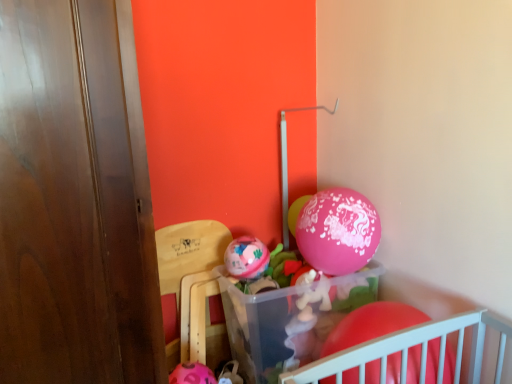
Where is `wooden chair at lower left`? wooden chair at lower left is located at coordinates (185, 274).

This screenshot has width=512, height=384. Identify the location of matte pink balloon at center, the 2th balloon when ordered from bottom to top. (246, 258).

Image resolution: width=512 pixels, height=384 pixels. In order to click on wooden chair at lower left in this screenshot , I will do `click(185, 274)`.

Measure the distance from pink glossy balloon at center, which ranks as the second balloon in left-to-right order, to matte pink balloon at center, placed as the first balloon when sorted from left to right.

pink glossy balloon at center, which ranks as the second balloon in left-to-right order, and matte pink balloon at center, placed as the first balloon when sorted from left to right, are 9.30 inches apart.

Starting from the matte pink balloon at center, which is the 2th balloon in top-to-bottom order, which balloon is the 1st one to the right? Please provide its 2D coordinates.

[(296, 212)]

Can you confirm if pink glossy balloon at center, the 2th balloon viewed from the right, is taller than matte pink balloon at center, the second balloon when ordered from back to front?

Indeed, pink glossy balloon at center, the 2th balloon viewed from the right, has a greater height compared to matte pink balloon at center, the second balloon when ordered from back to front.

From a real-world perspective, is pink glossy balloon at center, the 2th balloon viewed from the right, physically below matte pink balloon at center, placed as the first balloon when sorted from left to right?

No.

Is wooden chair at lower left wider or thinner than rubber matte balloon at lower right, the 3th balloon when ordered from back to front?

wooden chair at lower left is thinner than rubber matte balloon at lower right, the 3th balloon when ordered from back to front.

From a real-world perspective, is wooden chair at lower left positioned under rubber matte balloon at lower right, the third balloon when ordered from left to right, based on gravity?

Yes.

Does wooden chair at lower left turn towards rubber matte balloon at lower right, the third balloon viewed from the top?

No, wooden chair at lower left is not facing towards rubber matte balloon at lower right, the third balloon viewed from the top.

The width and height of the screenshot is (512, 384). I want to click on armchair behind the rubber matte balloon at lower right, which is the first balloon from front to back, so click(x=185, y=274).

Considering the relative sizes of matte pink balloon at center, which is the 2th balloon in top-to-bottom order, and wooden chair at lower left in the image provided, is matte pink balloon at center, which is the 2th balloon in top-to-bottom order, smaller than wooden chair at lower left?

Yes, matte pink balloon at center, which is the 2th balloon in top-to-bottom order, is smaller than wooden chair at lower left.

Is matte pink balloon at center, the 2th balloon when ordered from bottom to top, aimed at wooden chair at lower left?

No, matte pink balloon at center, the 2th balloon when ordered from bottom to top, is not oriented towards wooden chair at lower left.

Considering the sizes of objects matte pink balloon at center, the 3th balloon viewed from the right, and wooden chair at lower left in the image provided, who is shorter, matte pink balloon at center, the 3th balloon viewed from the right, or wooden chair at lower left?

matte pink balloon at center, the 3th balloon viewed from the right, is shorter.

Is matte pink balloon at center, the 2th balloon when ordered from bottom to top, further to camera compared to wooden chair at lower left?

That is True.

Is wooden chair at lower left oriented away from matte pink balloon at center, the 3th balloon viewed from the right?

wooden chair at lower left does not have its back to matte pink balloon at center, the 3th balloon viewed from the right.

From the image's perspective, is wooden chair at lower left over matte pink balloon at center, the 3th balloon viewed from the right?

No, from the image's perspective, wooden chair at lower left is not above matte pink balloon at center, the 3th balloon viewed from the right.

Considering the sizes of objects wooden chair at lower left and matte pink balloon at center, the second balloon when ordered from back to front, in the image provided, who is taller, wooden chair at lower left or matte pink balloon at center, the second balloon when ordered from back to front,?

wooden chair at lower left.

Between pink glossy balloon at center, which is the third balloon from front to back, and wooden chair at lower left, which one has smaller width?

pink glossy balloon at center, which is the third balloon from front to back, is thinner.

Between pink glossy balloon at center, acting as the 3th balloon starting from the bottom, and wooden chair at lower left, which one appears on the right side from the viewer's perspective?

Positioned to the right is pink glossy balloon at center, acting as the 3th balloon starting from the bottom.

Locate an element on the screen. Image resolution: width=512 pixels, height=384 pixels. armchair in front of the pink glossy balloon at center, the 1th balloon positioned from the top is located at coordinates (185, 274).

Considering the sizes of pink glossy balloon at center, acting as the 3th balloon starting from the bottom, and wooden chair at lower left in the image, is pink glossy balloon at center, acting as the 3th balloon starting from the bottom, bigger or smaller than wooden chair at lower left?

pink glossy balloon at center, acting as the 3th balloon starting from the bottom, is smaller than wooden chair at lower left.

Considering the sizes of pink glossy balloon at center, the 1th balloon positioned from the back, and rubber matte balloon at lower right, the third balloon when ordered from left to right, in the image, is pink glossy balloon at center, the 1th balloon positioned from the back, wider or thinner than rubber matte balloon at lower right, the third balloon when ordered from left to right,?

Considering their sizes, pink glossy balloon at center, the 1th balloon positioned from the back, looks slimmer than rubber matte balloon at lower right, the third balloon when ordered from left to right.

From the image's perspective, who appears lower, pink glossy balloon at center, the 1th balloon positioned from the back, or rubber matte balloon at lower right, the third balloon viewed from the top?

rubber matte balloon at lower right, the third balloon viewed from the top.

Which is less distant, (x=298, y=202) or (x=371, y=325)?

Positioned in front is point (x=371, y=325).

How different are the orientations of rubber matte balloon at lower right, marked as the 1th balloon in a bottom-to-top arrangement, and wooden chair at lower left in degrees?

They differ by 91.2 degrees in their facing directions.

Is rubber matte balloon at lower right, the third balloon viewed from the top, aimed at wooden chair at lower left?

No.

From the image's perspective, which one is positioned lower, rubber matte balloon at lower right, which is the first balloon from front to back, or wooden chair at lower left?

rubber matte balloon at lower right, which is the first balloon from front to back, from the image's perspective.

The width and height of the screenshot is (512, 384). I want to click on armchair lying behind the rubber matte balloon at lower right, marked as the 1th balloon in a bottom-to-top arrangement, so click(x=185, y=274).

Which balloon is the 1st one when counting from the right side of the matte pink balloon at center, the second balloon when ordered from back to front? Please provide its 2D coordinates.

[(296, 212)]

At what (x,y) coordinates should I click in order to perform the action: click on armchair directly beneath the rubber matte balloon at lower right, which is the 1th balloon from right to left (from a real-world perspective). Please return your answer as a coordinate pair (x, y). The image size is (512, 384). Looking at the image, I should click on (185, 274).

Estimate the real-world distances between objects in this image. Which object is closer to pink glossy balloon at center, which ranks as the second balloon in left-to-right order, matte pink balloon at center, placed as the first balloon when sorted from left to right, or wooden chair at lower left?

matte pink balloon at center, placed as the first balloon when sorted from left to right, is closer to pink glossy balloon at center, which ranks as the second balloon in left-to-right order.

When comparing their distances from rubber matte balloon at lower right, the 3th balloon when ordered from back to front, does pink glossy balloon at center, which is the third balloon from front to back, or matte pink balloon at center, arranged as the second balloon when viewed from the front, seem closer?

Among the two, matte pink balloon at center, arranged as the second balloon when viewed from the front, is located nearer to rubber matte balloon at lower right, the 3th balloon when ordered from back to front.

From the image, which object appears to be nearer to matte pink balloon at center, the 2th balloon when ordered from bottom to top, wooden chair at lower left or rubber matte balloon at lower right, marked as the 1th balloon in a bottom-to-top arrangement?

wooden chair at lower left is closer to matte pink balloon at center, the 2th balloon when ordered from bottom to top.

Considering their positions, is matte pink balloon at center, arranged as the second balloon when viewed from the front, positioned further to wooden chair at lower left than rubber matte balloon at lower right, which is the 1th balloon from right to left?

Based on the image, rubber matte balloon at lower right, which is the 1th balloon from right to left, appears to be further to wooden chair at lower left.

When comparing their distances from pink glossy balloon at center, the 1th balloon positioned from the back, does rubber matte balloon at lower right, the third balloon when ordered from left to right, or matte pink balloon at center, the second balloon when ordered from back to front, seem further?

rubber matte balloon at lower right, the third balloon when ordered from left to right, is positioned further to the anchor pink glossy balloon at center, the 1th balloon positioned from the back.

From the image, which object appears to be farther from pink glossy balloon at center, which ranks as the second balloon in left-to-right order, rubber matte balloon at lower right, which is the 1th balloon from right to left, or wooden chair at lower left?

rubber matte balloon at lower right, which is the 1th balloon from right to left, is positioned further to the anchor pink glossy balloon at center, which ranks as the second balloon in left-to-right order.

When comparing their distances from wooden chair at lower left, does pink glossy balloon at center, which ranks as the second balloon in left-to-right order, or matte pink balloon at center, which is the 2th balloon in top-to-bottom order, seem further?

pink glossy balloon at center, which ranks as the second balloon in left-to-right order.

Considering their positions, is rubber matte balloon at lower right, the 3th balloon when ordered from back to front, positioned further to matte pink balloon at center, the 3th balloon viewed from the right, than wooden chair at lower left?

Based on the image, rubber matte balloon at lower right, the 3th balloon when ordered from back to front, appears to be further to matte pink balloon at center, the 3th balloon viewed from the right.

This screenshot has height=384, width=512. I want to click on balloon between rubber matte balloon at lower right, the 3th balloon when ordered from back to front, and pink glossy balloon at center, the 1th balloon positioned from the top, in the front-back direction, so click(x=246, y=258).

Find the location of a particular element. armchair located between rubber matte balloon at lower right, the third balloon when ordered from left to right, and pink glossy balloon at center, acting as the 3th balloon starting from the bottom, in the depth direction is located at coordinates (185, 274).

Locate an element on the screen. balloon between wooden chair at lower left and pink glossy balloon at center, acting as the 3th balloon starting from the bottom is located at coordinates click(x=246, y=258).